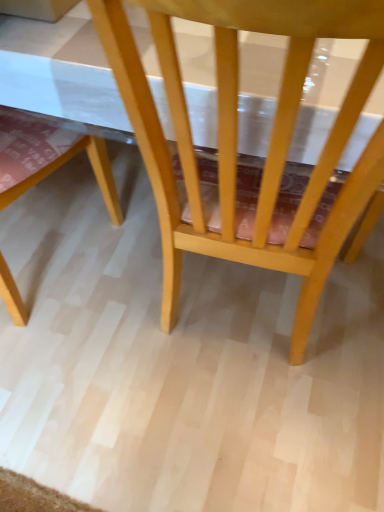
Question: Should I look upward or downward to see light wood chair at lower left, the second chair in the right-to-left sequence?

Choices:
 (A) up
 (B) down

Answer: (A)

Question: Can you confirm if light wood chair at center, which is the 2th chair from left to right, is shorter than light wood chair at lower left, the first chair from the left?

Choices:
 (A) no
 (B) yes

Answer: (A)

Question: Is light wood chair at center, which is the 2th chair from left to right, in front of light wood chair at lower left, the first chair from the left?

Choices:
 (A) yes
 (B) no

Answer: (A)

Question: Is light wood chair at center, the first chair positioned from the right, bigger than light wood chair at lower left, the first chair from the left?

Choices:
 (A) yes
 (B) no

Answer: (A)

Question: Is light wood chair at center, which is the 2th chair from left to right, far away from light wood chair at lower left, the first chair from the left?

Choices:
 (A) yes
 (B) no

Answer: (B)

Question: Considering the relative sizes of light wood chair at center, which is the 2th chair from left to right, and light wood chair at lower left, the first chair from the left, in the image provided, is light wood chair at center, which is the 2th chair from left to right, smaller than light wood chair at lower left, the first chair from the left,?

Choices:
 (A) no
 (B) yes

Answer: (A)

Question: From a real-world perspective, does light wood chair at center, the first chair positioned from the right, sit lower than light wood chair at lower left, the first chair from the left?

Choices:
 (A) yes
 (B) no

Answer: (B)

Question: Is light wood chair at lower left, the second chair in the right-to-left sequence, wider than light wood chair at center, which is the 2th chair from left to right?

Choices:
 (A) no
 (B) yes

Answer: (A)

Question: Considering the relative sizes of light wood chair at lower left, the second chair in the right-to-left sequence, and light wood chair at center, the first chair positioned from the right, in the image provided, is light wood chair at lower left, the second chair in the right-to-left sequence, taller than light wood chair at center, the first chair positioned from the right,?

Choices:
 (A) no
 (B) yes

Answer: (A)

Question: From a real-world perspective, is light wood chair at lower left, the first chair from the left, physically below light wood chair at center, which is the 2th chair from left to right?

Choices:
 (A) yes
 (B) no

Answer: (A)

Question: Is light wood chair at lower left, the first chair from the left, bigger than light wood chair at center, the first chair positioned from the right?

Choices:
 (A) yes
 (B) no

Answer: (B)

Question: Is light wood chair at lower left, the second chair in the right-to-left sequence, positioned far away from light wood chair at center, which is the 2th chair from left to right?

Choices:
 (A) yes
 (B) no

Answer: (B)

Question: From the image's perspective, does light wood chair at lower left, the first chair from the left, appear higher than light wood chair at center, which is the 2th chair from left to right?

Choices:
 (A) no
 (B) yes

Answer: (A)

Question: Considering the relative positions of light wood chair at center, which is the 2th chair from left to right, and light wood chair at lower left, the second chair in the right-to-left sequence, in the image provided, is light wood chair at center, which is the 2th chair from left to right, to the left or to the right of light wood chair at lower left, the second chair in the right-to-left sequence,?

Choices:
 (A) right
 (B) left

Answer: (A)